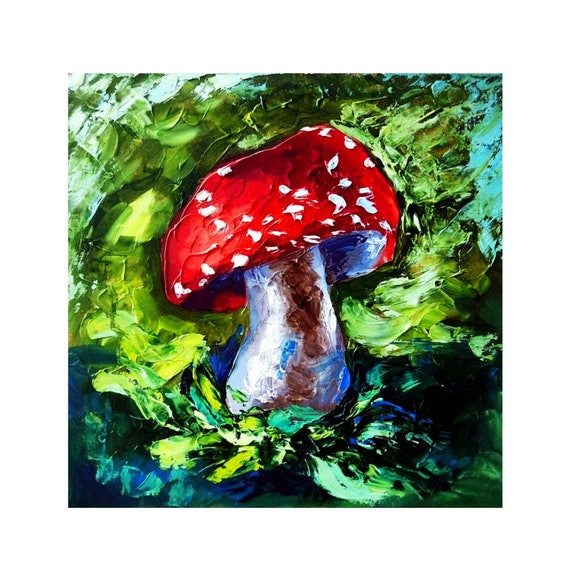
In order to click on lower right corner of artwork in this screenshot , I will do `click(500, 504)`.